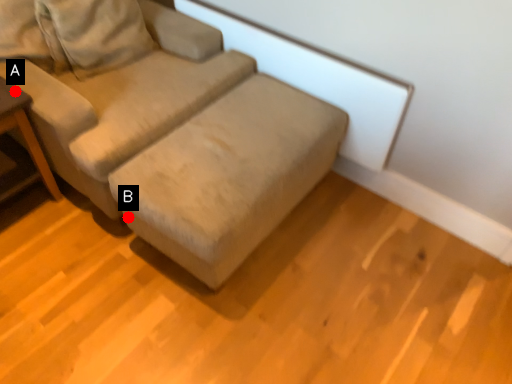
Question: Two points are circled on the image, labeled by A and B beside each circle. Among these points, which one is nearest to the camera?

Choices:
 (A) A is closer
 (B) B is closer

Answer: (A)